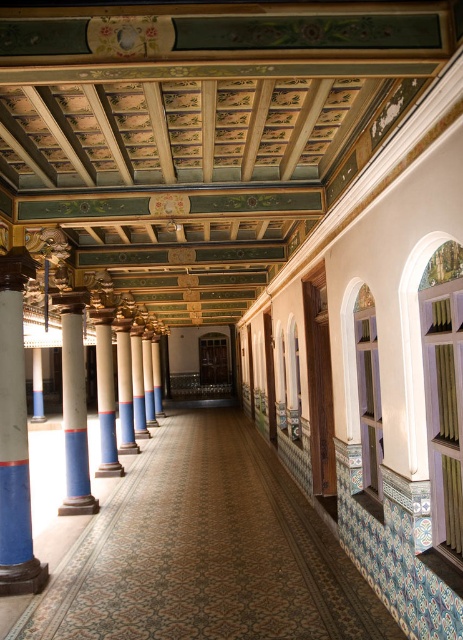
Between marble column at left and white glossy column at center, which one appears on the right side from the viewer's perspective?

marble column at left

Is point (6, 488) closer to camera compared to point (85, 385)?

Yes.

Locate an element on the screen. Image resolution: width=463 pixels, height=640 pixels. marble column at left is located at coordinates coord(14,435).